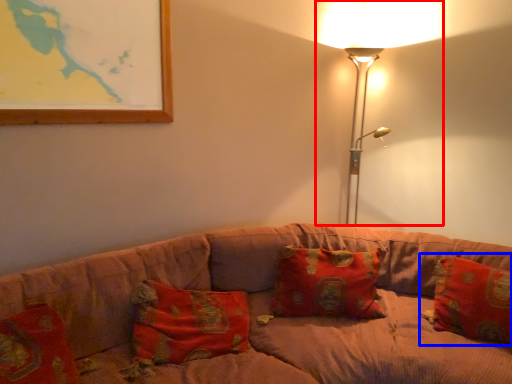
Question: Which object appears farthest to the camera in this image, lamp (highlighted by a red box) or pillow (highlighted by a blue box)?

Choices:
 (A) lamp
 (B) pillow

Answer: (A)